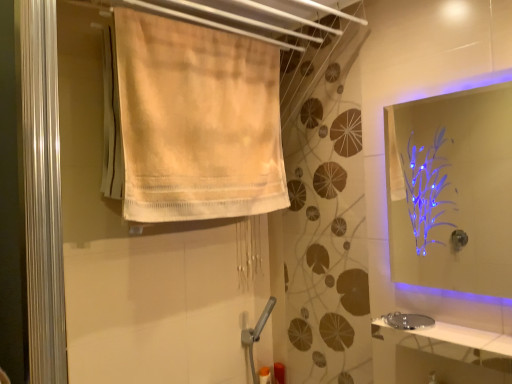
Question: Is transparent acrylic mirror at upper right at the right side of translucent plastic bottle at lower center?

Choices:
 (A) yes
 (B) no

Answer: (A)

Question: Is transparent acrylic mirror at upper right positioned far away from translucent plastic bottle at lower center?

Choices:
 (A) yes
 (B) no

Answer: (A)

Question: Can you confirm if transparent acrylic mirror at upper right is smaller than translucent plastic bottle at lower center?

Choices:
 (A) no
 (B) yes

Answer: (A)

Question: Is transparent acrylic mirror at upper right aimed at translucent plastic bottle at lower center?

Choices:
 (A) yes
 (B) no

Answer: (B)

Question: Is transparent acrylic mirror at upper right looking in the opposite direction of translucent plastic bottle at lower center?

Choices:
 (A) no
 (B) yes

Answer: (A)

Question: In terms of size, does silver metallic sink at lower right appear bigger or smaller than transparent acrylic mirror at upper right?

Choices:
 (A) big
 (B) small

Answer: (B)

Question: Visually, is silver metallic sink at lower right positioned to the left or to the right of transparent acrylic mirror at upper right?

Choices:
 (A) right
 (B) left

Answer: (B)

Question: From their relative heights in the image, would you say silver metallic sink at lower right is taller or shorter than transparent acrylic mirror at upper right?

Choices:
 (A) short
 (B) tall

Answer: (A)

Question: Is silver metallic sink at lower right in front of or behind transparent acrylic mirror at upper right in the image?

Choices:
 (A) front
 (B) behind

Answer: (B)

Question: In terms of size, does transparent acrylic mirror at upper right appear bigger or smaller than white glossy counter top at lower right?

Choices:
 (A) big
 (B) small

Answer: (A)

Question: Is transparent acrylic mirror at upper right inside or outside of white glossy counter top at lower right?

Choices:
 (A) outside
 (B) inside

Answer: (A)

Question: Considering the positions of transparent acrylic mirror at upper right and white glossy counter top at lower right in the image, is transparent acrylic mirror at upper right taller or shorter than white glossy counter top at lower right?

Choices:
 (A) tall
 (B) short

Answer: (A)

Question: From the image's perspective, is transparent acrylic mirror at upper right positioned above or below white glossy counter top at lower right?

Choices:
 (A) above
 (B) below

Answer: (A)

Question: Based on their positions, is white glossy counter top at lower right located to the left or right of translucent plastic bottle at lower center?

Choices:
 (A) right
 (B) left

Answer: (A)

Question: Looking at the image, does white glossy counter top at lower right seem bigger or smaller compared to translucent plastic bottle at lower center?

Choices:
 (A) small
 (B) big

Answer: (B)